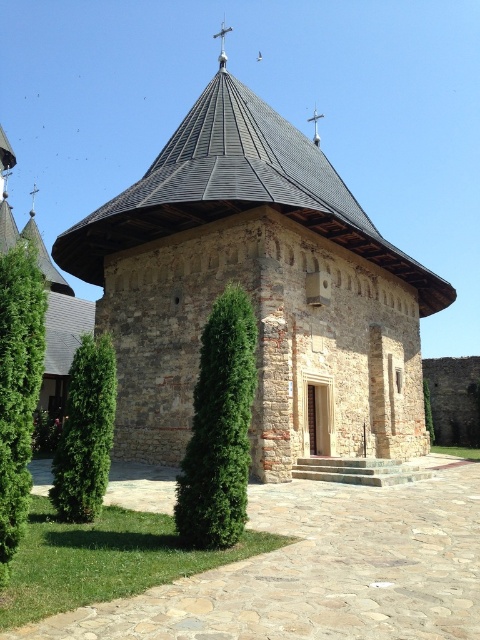
Question: Among these points, which one is farthest from the camera?

Choices:
 (A) (241, 440)
 (B) (97, 376)

Answer: (B)

Question: Is brown stone chapel at center above green leafy tree at lower left?

Choices:
 (A) no
 (B) yes

Answer: (B)

Question: Does brown stone chapel at center lie behind green leafy tree at center?

Choices:
 (A) yes
 (B) no

Answer: (A)

Question: Is brown stone chapel at center to the right of green textured bush at left from the viewer's perspective?

Choices:
 (A) yes
 (B) no

Answer: (A)

Question: Which object is positioned closest to the green leafy tree at center?

Choices:
 (A) brown stone chapel at center
 (B) brown stone church at lower left
 (C) green textured bush at left
 (D) green leafy tree at lower left

Answer: (D)

Question: Which of the following is the farthest from the observer?

Choices:
 (A) (79, 406)
 (B) (237, 339)
 (C) (144, 352)

Answer: (C)